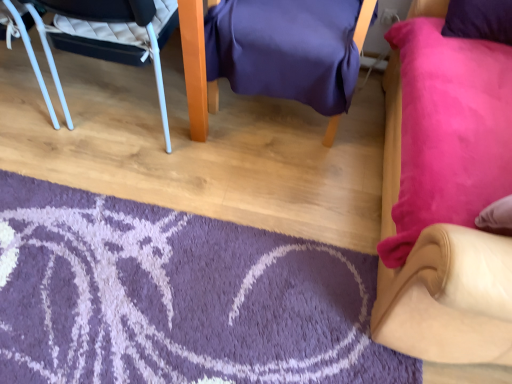
Question: Is suede-like beige chair at lower right, the first chair in the right-to-left sequence, a part of purple fabric chair at center, placed as the second chair when sorted from left to right?

Choices:
 (A) no
 (B) yes

Answer: (A)

Question: Can you confirm if purple fabric chair at center, which is the 2th chair in right-to-left order, is bigger than suede-like beige chair at lower right, the third chair when ordered from left to right?

Choices:
 (A) no
 (B) yes

Answer: (A)

Question: Is purple fabric chair at center, which is the 2th chair in right-to-left order, facing towards suede-like beige chair at lower right, the first chair in the right-to-left sequence?

Choices:
 (A) yes
 (B) no

Answer: (B)

Question: Does purple fabric chair at center, which is the 2th chair in right-to-left order, have a greater height compared to suede-like beige chair at lower right, the first chair in the right-to-left sequence?

Choices:
 (A) no
 (B) yes

Answer: (A)

Question: Is purple fabric chair at center, placed as the second chair when sorted from left to right, far from suede-like beige chair at lower right, the first chair in the right-to-left sequence?

Choices:
 (A) yes
 (B) no

Answer: (B)

Question: Is white plastic chair at left, the 1th chair in the left-to-right sequence, situated inside purple fabric chair at center, which is the 2th chair in right-to-left order, or outside?

Choices:
 (A) inside
 (B) outside

Answer: (B)

Question: From the image's perspective, is white plastic chair at left, which is the 3th chair in right-to-left order, positioned above or below purple fabric chair at center, placed as the second chair when sorted from left to right?

Choices:
 (A) below
 (B) above

Answer: (A)

Question: Does point (124, 16) appear closer or farther from the camera than point (187, 29)?

Choices:
 (A) closer
 (B) farther

Answer: (B)

Question: Is white plastic chair at left, the 1th chair in the left-to-right sequence, bigger or smaller than purple fabric chair at center, placed as the second chair when sorted from left to right?

Choices:
 (A) big
 (B) small

Answer: (B)

Question: Considering their positions, is purple fabric chair at center, which is the 2th chair in right-to-left order, located in front of or behind purple shaggy rug at lower left?

Choices:
 (A) front
 (B) behind

Answer: (B)

Question: From a real-world perspective, relative to purple shaggy rug at lower left, is purple fabric chair at center, which is the 2th chair in right-to-left order, vertically above or below?

Choices:
 (A) above
 (B) below

Answer: (A)

Question: Considering the positions of purple fabric chair at center, which is the 2th chair in right-to-left order, and purple shaggy rug at lower left in the image, is purple fabric chair at center, which is the 2th chair in right-to-left order, wider or thinner than purple shaggy rug at lower left?

Choices:
 (A) thin
 (B) wide

Answer: (A)

Question: Does point (207, 89) appear closer or farther from the camera than point (10, 369)?

Choices:
 (A) closer
 (B) farther

Answer: (B)

Question: Is point (1, 279) positioned closer to the camera than point (382, 342)?

Choices:
 (A) closer
 (B) farther

Answer: (B)

Question: From a real-world perspective, is purple shaggy rug at lower left physically located above or below suede-like beige chair at lower right, the first chair in the right-to-left sequence?

Choices:
 (A) above
 (B) below

Answer: (B)